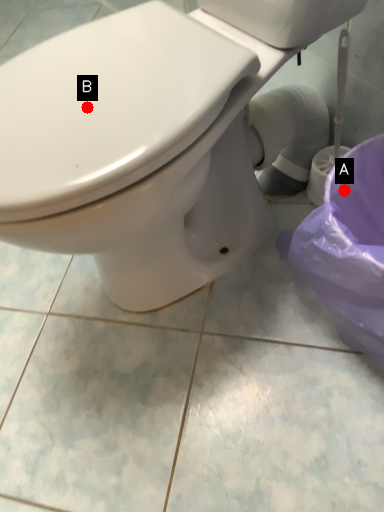
Question: Two points are circled on the image, labeled by A and B beside each circle. Among these points, which one is nearest to the camera?

Choices:
 (A) A is closer
 (B) B is closer

Answer: (B)